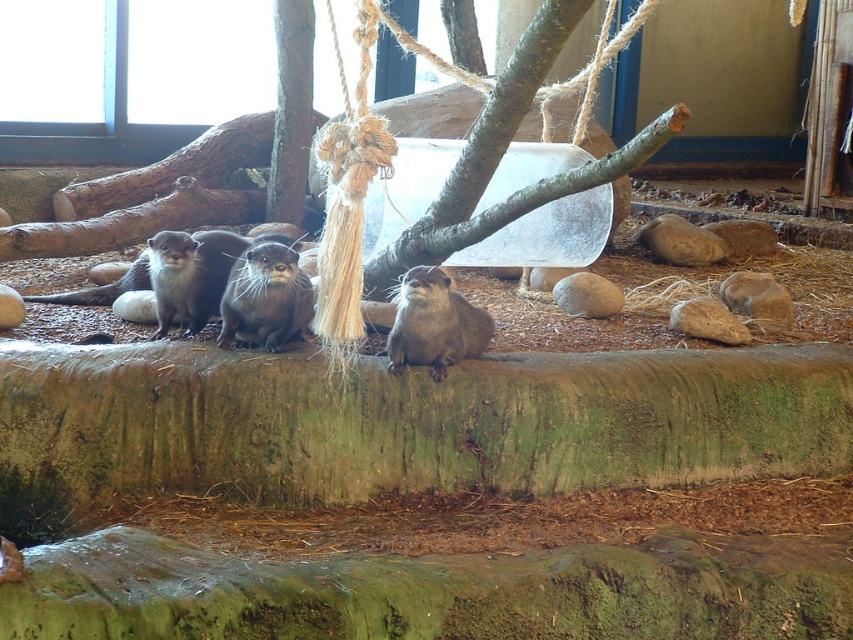
Question: Does shiny brown otter at center lie in front of soft brown fur otter at center?

Choices:
 (A) no
 (B) yes

Answer: (A)

Question: Among these points, which one is farthest from the camera?

Choices:
 (A) (401, 348)
 (B) (276, 323)

Answer: (B)

Question: Which object is farther from the camera taking this photo?

Choices:
 (A) soft brown fur otter at center
 (B) shiny brown otter at center

Answer: (B)

Question: Is shiny brown otter at center positioned behind soft brown fur otter at center?

Choices:
 (A) yes
 (B) no

Answer: (A)

Question: Is shiny brown otter at center thinner than soft brown fur otter at center?

Choices:
 (A) no
 (B) yes

Answer: (B)